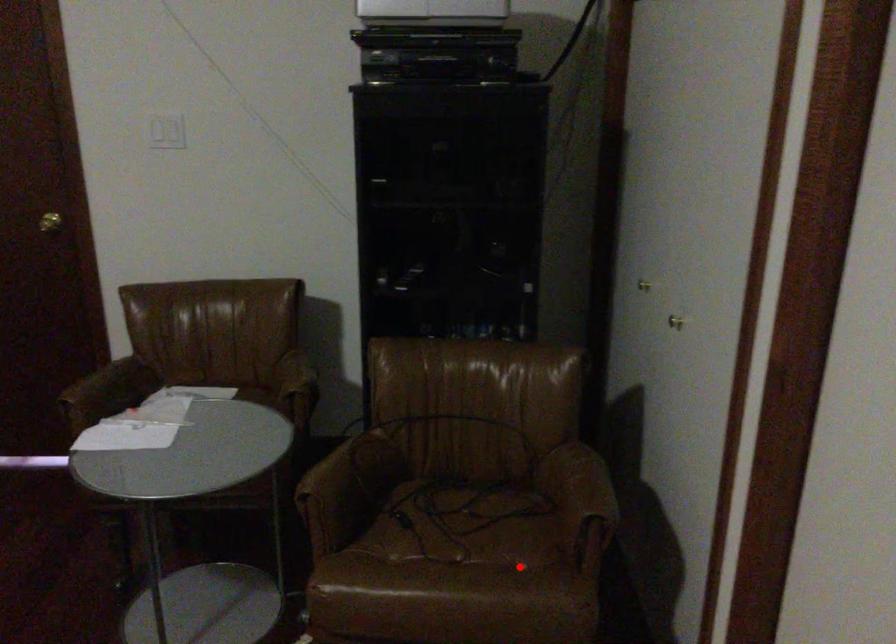
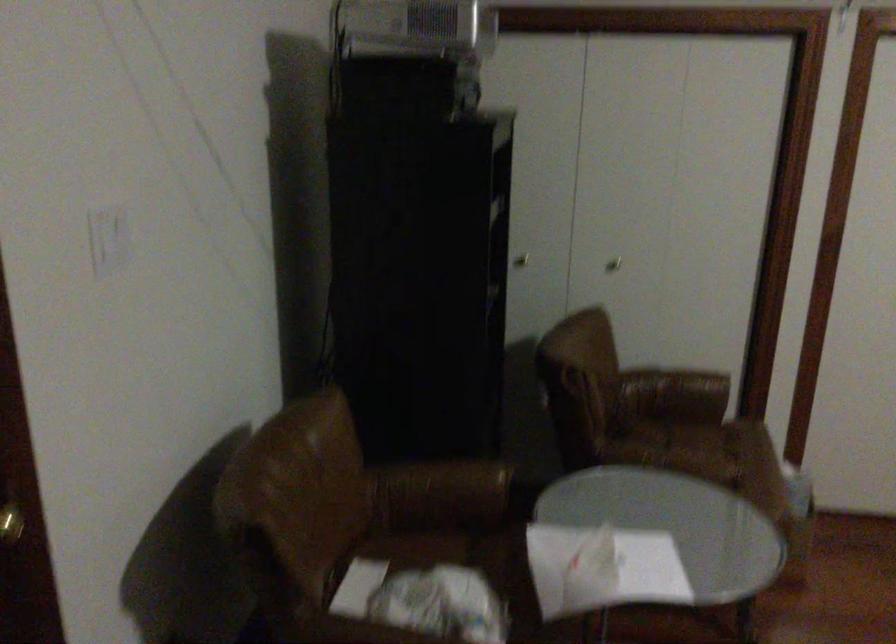
The point at the highlighted location is marked in the first image. Where is the corresponding point in the second image?

(718, 442)